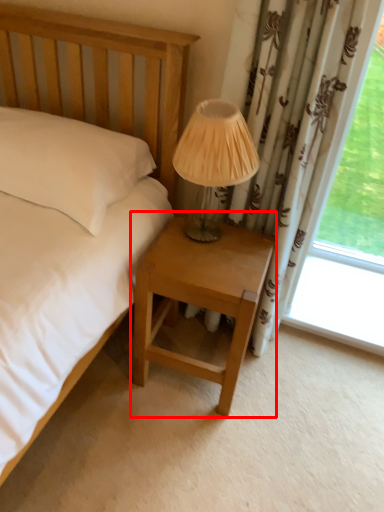
Question: From the image's perspective, what is the correct spatial relationship of nightstand (annotated by the red box) in relation to table lamp?

Choices:
 (A) below
 (B) above

Answer: (A)